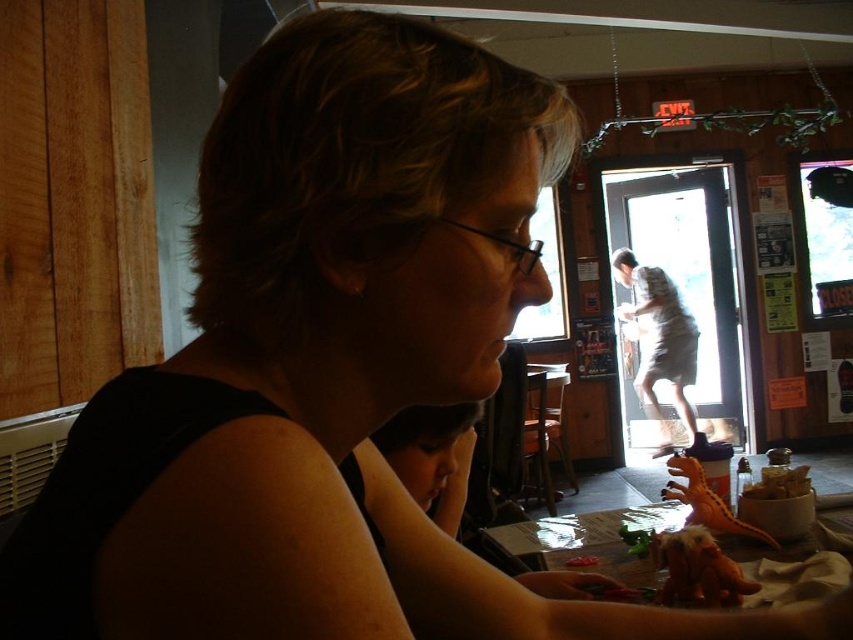
Question: Is wooden table at lower center positioned behind brown crumbly food at lower right?

Choices:
 (A) yes
 (B) no

Answer: (B)

Question: Among these objects, which one is nearest to the camera?

Choices:
 (A) brown crumbly food at lower right
 (B) wooden table at lower center

Answer: (B)

Question: Can you confirm if wooden table at lower center is thinner than brown crumbly food at lower right?

Choices:
 (A) no
 (B) yes

Answer: (A)

Question: Is wooden table at lower center closer to camera compared to brown crumbly food at lower right?

Choices:
 (A) no
 (B) yes

Answer: (B)

Question: Which object is farther from the camera taking this photo?

Choices:
 (A) wooden table at lower center
 (B) brown crumbly food at lower right

Answer: (B)

Question: Which object is closer to the camera taking this photo?

Choices:
 (A) brown crumbly food at lower right
 (B) wooden table at lower center

Answer: (B)